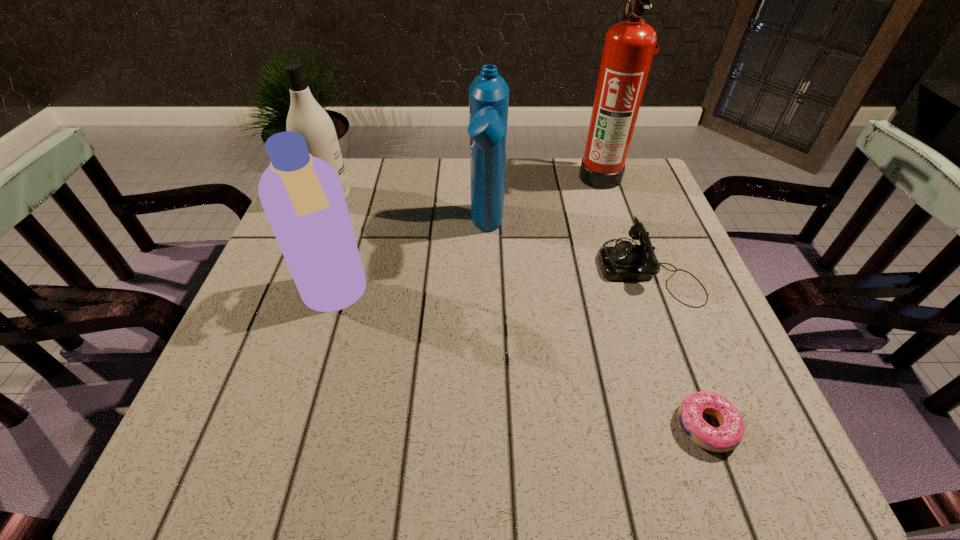
Image resolution: width=960 pixels, height=540 pixels. I want to click on free space between the nearest shampoo and the nearest object, so click(x=520, y=361).

I want to click on empty location between the fire extinguisher and the nearest shampoo, so click(468, 237).

This screenshot has width=960, height=540. I want to click on vacant space that is in between the fourth object from right to left and the shortest object, so click(x=597, y=328).

Locate an element on the screen. free point between the tallest object and the rightmost shampoo is located at coordinates (544, 203).

Locate an element on the screen. free space between the nearest shampoo and the tallest object is located at coordinates (468, 237).

Identify which object is the fifth closest to the fire extinguisher. Please provide its 2D coordinates. Your answer should be formatted as a tuple, i.e. [(x, y)], where the tuple contains the x and y coordinates of a point satisfying the conditions above.

[(306, 117)]

Select which object is the fourth closest to the tallest object. Please provide its 2D coordinates. Your answer should be formatted as a tuple, i.e. [(x, y)], where the tuple contains the x and y coordinates of a point satisfying the conditions above.

[(728, 436)]

Select which shampoo is the closest to the nearest shampoo. Please provide its 2D coordinates. Your answer should be formatted as a tuple, i.e. [(x, y)], where the tuple contains the x and y coordinates of a point satisfying the conditions above.

[(488, 93)]

Locate which shampoo is the second closest to the nearest shampoo. Please provide its 2D coordinates. Your answer should be formatted as a tuple, i.e. [(x, y)], where the tuple contains the x and y coordinates of a point satisfying the conditions above.

[(306, 117)]

Identify the location of blank area in the image that satisfies the following two spatial constraints: 1. with the nozzle pointing from the back of the nearest object; 2. on the left side of the fire extinguisher. (685, 426).